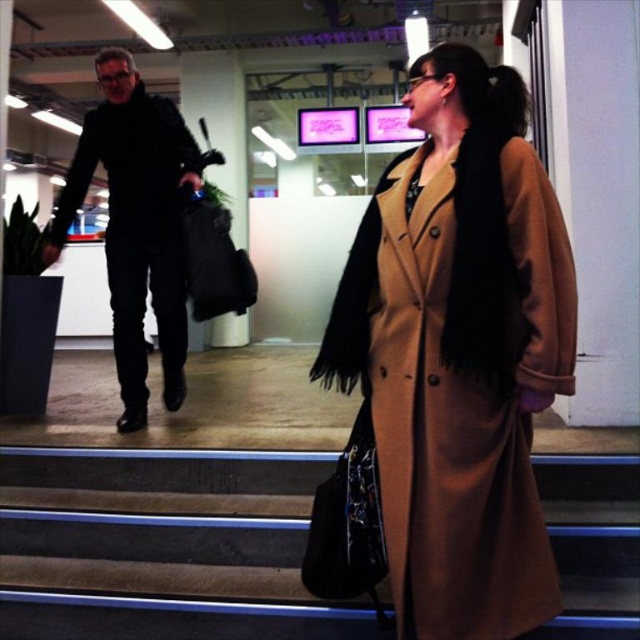
Question: Which of these objects is positioned farthest from the tan wool coat at center?

Choices:
 (A) brown wooden stairs at center
 (B) black matte jacket at left

Answer: (B)

Question: Is tan wool coat at center to the left of black matte jacket at left from the viewer's perspective?

Choices:
 (A) no
 (B) yes

Answer: (A)

Question: Does tan wool coat at center appear on the left side of brown wooden stairs at center?

Choices:
 (A) yes
 (B) no

Answer: (B)

Question: Among these points, which one is farthest from the camera?

Choices:
 (A) (125, 529)
 (B) (413, 540)
 (C) (148, 180)

Answer: (C)

Question: Which point is closer to the camera?

Choices:
 (A) tan wool coat at center
 (B) black matte jacket at left
 (C) brown wooden stairs at center

Answer: (A)

Question: Can you confirm if tan wool coat at center is wider than brown wooden stairs at center?

Choices:
 (A) yes
 (B) no

Answer: (B)